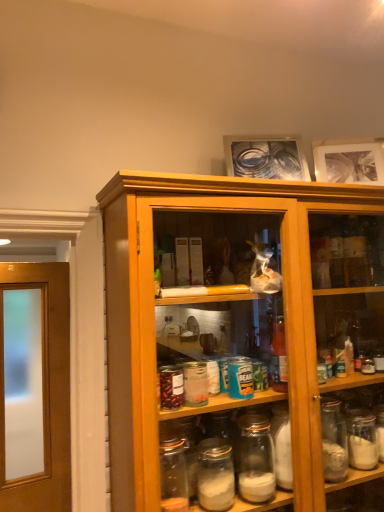
Describe the element at coordinates (266, 158) in the screenshot. Image resolution: width=384 pixels, height=512 pixels. I see `metallic silver picture frame at upper center, placed as the 1th picture frame when sorted from left to right` at that location.

Where is `metallic silver picture frame at upper center, which is the 2th picture frame in right-to-left order`? Image resolution: width=384 pixels, height=512 pixels. metallic silver picture frame at upper center, which is the 2th picture frame in right-to-left order is located at coordinates (266, 158).

Where is `matte black picture frame at upper right, the 1th picture frame from the right`? The image size is (384, 512). matte black picture frame at upper right, the 1th picture frame from the right is located at coordinates (349, 163).

What do you see at coordinates (349, 163) in the screenshot?
I see `matte black picture frame at upper right, arranged as the 2th picture frame when viewed from the left` at bounding box center [349, 163].

You are a GUI agent. You are given a task and a screenshot of the screen. Output one action in this format:
    pyautogui.click(x=<x>, y=<y>)
    Task: Click on the metallic silver picture frame at upper center, which is the 2th picture frame in right-to-left order
    The image size is (384, 512).
    Given the screenshot: What is the action you would take?
    pyautogui.click(x=266, y=158)

Considering the positions of objects metallic silver picture frame at upper center, which is the 2th picture frame in right-to-left order, and matte black picture frame at upper right, arranged as the 2th picture frame when viewed from the left, in the image provided, who is more to the left, metallic silver picture frame at upper center, which is the 2th picture frame in right-to-left order, or matte black picture frame at upper right, arranged as the 2th picture frame when viewed from the left,?

Positioned to the left is metallic silver picture frame at upper center, which is the 2th picture frame in right-to-left order.

Based on the photo, is metallic silver picture frame at upper center, which is the 2th picture frame in right-to-left order, positioned in front of matte black picture frame at upper right, arranged as the 2th picture frame when viewed from the left?

Yes, metallic silver picture frame at upper center, which is the 2th picture frame in right-to-left order, is in front of matte black picture frame at upper right, arranged as the 2th picture frame when viewed from the left.

Which is closer, (234, 160) or (378, 144)?

Clearly, point (234, 160) is closer to the camera than point (378, 144).

From the image's perspective, is metallic silver picture frame at upper center, which is the 2th picture frame in right-to-left order, beneath matte black picture frame at upper right, the 1th picture frame from the right?

Actually, metallic silver picture frame at upper center, which is the 2th picture frame in right-to-left order, appears above matte black picture frame at upper right, the 1th picture frame from the right, in the image.

From a real-world perspective, which is physically below, metallic silver picture frame at upper center, which is the 2th picture frame in right-to-left order, or matte black picture frame at upper right, the 1th picture frame from the right?

matte black picture frame at upper right, the 1th picture frame from the right, from a real-world perspective.

Which object is wider, metallic silver picture frame at upper center, which is the 2th picture frame in right-to-left order, or matte black picture frame at upper right, the 1th picture frame from the right?

Wider between the two is metallic silver picture frame at upper center, which is the 2th picture frame in right-to-left order.

In the scene shown: Is metallic silver picture frame at upper center, placed as the 1th picture frame when sorted from left to right, taller than matte black picture frame at upper right, the 1th picture frame from the right?

Incorrect, the height of metallic silver picture frame at upper center, placed as the 1th picture frame when sorted from left to right, is not larger of that of matte black picture frame at upper right, the 1th picture frame from the right.

Can you confirm if metallic silver picture frame at upper center, placed as the 1th picture frame when sorted from left to right, is bigger than matte black picture frame at upper right, arranged as the 2th picture frame when viewed from the left?

Yes.

Is metallic silver picture frame at upper center, which is the 2th picture frame in right-to-left order, positioned beyond the bounds of matte black picture frame at upper right, arranged as the 2th picture frame when viewed from the left?

Yes, metallic silver picture frame at upper center, which is the 2th picture frame in right-to-left order, is not within matte black picture frame at upper right, arranged as the 2th picture frame when viewed from the left.

Is metallic silver picture frame at upper center, which is the 2th picture frame in right-to-left order, far away from matte black picture frame at upper right, arranged as the 2th picture frame when viewed from the left?

No, metallic silver picture frame at upper center, which is the 2th picture frame in right-to-left order, is in close proximity to matte black picture frame at upper right, arranged as the 2th picture frame when viewed from the left.

Consider the image. Is metallic silver picture frame at upper center, which is the 2th picture frame in right-to-left order, looking in the opposite direction of matte black picture frame at upper right, the 1th picture frame from the right?

metallic silver picture frame at upper center, which is the 2th picture frame in right-to-left order, is not turned away from matte black picture frame at upper right, the 1th picture frame from the right.

Can you tell me how much metallic silver picture frame at upper center, placed as the 1th picture frame when sorted from left to right, and matte black picture frame at upper right, arranged as the 2th picture frame when viewed from the left, differ in facing direction?

They differ by 13.7 degrees in their facing directions.

Where is `picture frame located above the matte black picture frame at upper right, arranged as the 2th picture frame when viewed from the left (from a real-world perspective)`? picture frame located above the matte black picture frame at upper right, arranged as the 2th picture frame when viewed from the left (from a real-world perspective) is located at coordinates (266, 158).

Which object is positioned more to the left, matte black picture frame at upper right, the 1th picture frame from the right, or metallic silver picture frame at upper center, placed as the 1th picture frame when sorted from left to right?

Positioned to the left is metallic silver picture frame at upper center, placed as the 1th picture frame when sorted from left to right.

Which object is further away from the camera taking this photo, matte black picture frame at upper right, the 1th picture frame from the right, or metallic silver picture frame at upper center, placed as the 1th picture frame when sorted from left to right?

matte black picture frame at upper right, the 1th picture frame from the right, is behind.

Is point (381, 166) positioned in front of point (307, 176)?

Yes, it is.

From the image's perspective, is matte black picture frame at upper right, the 1th picture frame from the right, on metallic silver picture frame at upper center, placed as the 1th picture frame when sorted from left to right?

Incorrect, from the image's perspective, matte black picture frame at upper right, the 1th picture frame from the right, is lower than metallic silver picture frame at upper center, placed as the 1th picture frame when sorted from left to right.

From a real-world perspective, which is physically above, matte black picture frame at upper right, the 1th picture frame from the right, or metallic silver picture frame at upper center, which is the 2th picture frame in right-to-left order?

In real-world perspective, metallic silver picture frame at upper center, which is the 2th picture frame in right-to-left order, is above.

Looking at their sizes, would you say matte black picture frame at upper right, arranged as the 2th picture frame when viewed from the left, is wider or thinner than metallic silver picture frame at upper center, placed as the 1th picture frame when sorted from left to right?

Considering their sizes, matte black picture frame at upper right, arranged as the 2th picture frame when viewed from the left, looks slimmer than metallic silver picture frame at upper center, placed as the 1th picture frame when sorted from left to right.

Who is shorter, matte black picture frame at upper right, arranged as the 2th picture frame when viewed from the left, or metallic silver picture frame at upper center, placed as the 1th picture frame when sorted from left to right?

With less height is metallic silver picture frame at upper center, placed as the 1th picture frame when sorted from left to right.

Who is bigger, matte black picture frame at upper right, arranged as the 2th picture frame when viewed from the left, or metallic silver picture frame at upper center, placed as the 1th picture frame when sorted from left to right?

Bigger between the two is metallic silver picture frame at upper center, placed as the 1th picture frame when sorted from left to right.

Would you say matte black picture frame at upper right, arranged as the 2th picture frame when viewed from the left, contains metallic silver picture frame at upper center, which is the 2th picture frame in right-to-left order?

No, matte black picture frame at upper right, arranged as the 2th picture frame when viewed from the left, does not contain metallic silver picture frame at upper center, which is the 2th picture frame in right-to-left order.

Looking at this image, are matte black picture frame at upper right, the 1th picture frame from the right, and metallic silver picture frame at upper center, which is the 2th picture frame in right-to-left order, beside each other?

There is a gap between matte black picture frame at upper right, the 1th picture frame from the right, and metallic silver picture frame at upper center, which is the 2th picture frame in right-to-left order.

Could you tell me if matte black picture frame at upper right, arranged as the 2th picture frame when viewed from the left, is turned towards metallic silver picture frame at upper center, placed as the 1th picture frame when sorted from left to right?

No, matte black picture frame at upper right, arranged as the 2th picture frame when viewed from the left, is not turned towards metallic silver picture frame at upper center, placed as the 1th picture frame when sorted from left to right.

Identify the location of picture frame behind the metallic silver picture frame at upper center, which is the 2th picture frame in right-to-left order. (349, 163).

Where is `picture frame located on the left of matte black picture frame at upper right, the 1th picture frame from the right`? Image resolution: width=384 pixels, height=512 pixels. picture frame located on the left of matte black picture frame at upper right, the 1th picture frame from the right is located at coordinates (266, 158).

Image resolution: width=384 pixels, height=512 pixels. What are the coordinates of `picture frame directly beneath the metallic silver picture frame at upper center, which is the 2th picture frame in right-to-left order (from a real-world perspective)` in the screenshot? It's located at (349, 163).